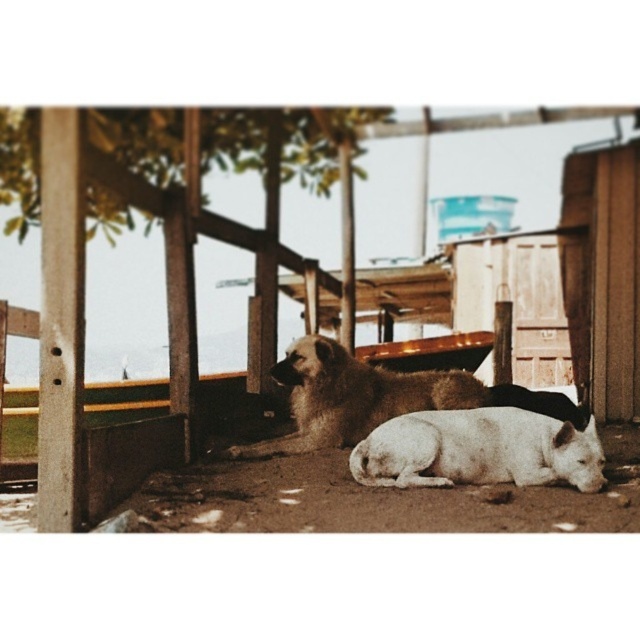
Is point (180, 384) positioned after point (336, 420)?

No, (180, 384) is closer to viewer.

Who is lower down, brown wooden dogs at center or brown fur dog at center?

brown fur dog at center

At what (x,y) coordinates should I click in order to perform the action: click on brown wooden dogs at center. Please return your answer as a coordinate pair (x, y). The image size is (640, 640). Looking at the image, I should click on (166, 305).

Identify the location of brown wooden dogs at center. Image resolution: width=640 pixels, height=640 pixels. [x=166, y=305].

Is point (81, 497) closer to viewer compared to point (392, 451)?

Yes, it is.

Is brown wooden dogs at center to the left of white smooth dog at lower center from the viewer's perspective?

Indeed, brown wooden dogs at center is positioned on the left side of white smooth dog at lower center.

Who is more forward, [90,179] or [451,419]?

Point [90,179] is in front.

You are a GUI agent. You are given a task and a screenshot of the screen. Output one action in this format:
    pyautogui.click(x=<x>, y=<y>)
    Task: Click on the brown wooden dogs at center
    
    Given the screenshot: What is the action you would take?
    pyautogui.click(x=166, y=305)

Is point (422, 477) farther from camera compared to point (336, 435)?

No.

Who is positioned more to the left, white smooth dog at lower center or brown fur dog at center?

brown fur dog at center is more to the left.

Is point (400, 416) behind point (369, 417)?

No.

You are a GUI agent. You are given a task and a screenshot of the screen. Output one action in this format:
    pyautogui.click(x=<x>, y=<y>)
    Task: Click on the white smooth dog at lower center
    The image size is (640, 640).
    Given the screenshot: What is the action you would take?
    pyautogui.click(x=477, y=451)